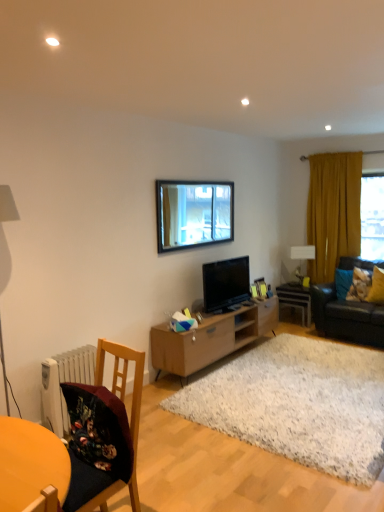
Question: Does white shaggy rug at center lie in front of yellow fabric pillow at right, acting as the second pillow starting from the left?

Choices:
 (A) yes
 (B) no

Answer: (A)

Question: Is white shaggy rug at center taller than yellow fabric pillow at right, acting as the second pillow starting from the left?

Choices:
 (A) yes
 (B) no

Answer: (B)

Question: Considering the relative sizes of white shaggy rug at center and yellow fabric pillow at right, acting as the second pillow starting from the left, in the image provided, is white shaggy rug at center shorter than yellow fabric pillow at right, acting as the second pillow starting from the left,?

Choices:
 (A) yes
 (B) no

Answer: (A)

Question: Can you confirm if white shaggy rug at center is smaller than yellow fabric pillow at right, acting as the second pillow starting from the left?

Choices:
 (A) yes
 (B) no

Answer: (B)

Question: Is white shaggy rug at center looking in the opposite direction of yellow fabric pillow at right, positioned as the 1th pillow in right-to-left order?

Choices:
 (A) yes
 (B) no

Answer: (B)

Question: Choose the correct answer: Is light brown wood tv stand at center inside white glossy side table at center or outside it?

Choices:
 (A) inside
 (B) outside

Answer: (B)

Question: From a real-world perspective, is light brown wood tv stand at center physically located above or below white glossy side table at center?

Choices:
 (A) below
 (B) above

Answer: (B)

Question: In terms of size, does light brown wood tv stand at center appear bigger or smaller than white glossy side table at center?

Choices:
 (A) small
 (B) big

Answer: (B)

Question: Considering their positions, is light brown wood tv stand at center located in front of or behind white glossy side table at center?

Choices:
 (A) front
 (B) behind

Answer: (A)

Question: From a real-world perspective, is white glossy side table at center physically located above or below wooden picture frame at center, placed as the 2th picture frame when sorted from right to left?

Choices:
 (A) below
 (B) above

Answer: (A)

Question: From the image's perspective, is white glossy side table at center located above or below wooden picture frame at center, which is the 1th picture frame in left-to-right order?

Choices:
 (A) above
 (B) below

Answer: (B)

Question: From their relative heights in the image, would you say white glossy side table at center is taller or shorter than wooden picture frame at center, which is the 1th picture frame in left-to-right order?

Choices:
 (A) tall
 (B) short

Answer: (A)

Question: Does point (304, 303) appear closer or farther from the camera than point (256, 285)?

Choices:
 (A) closer
 (B) farther

Answer: (B)

Question: Considering the positions of mustard yellow fabric curtain at right and wooden chair at lower left in the image, is mustard yellow fabric curtain at right wider or thinner than wooden chair at lower left?

Choices:
 (A) wide
 (B) thin

Answer: (B)

Question: Considering the positions of point (334, 184) and point (97, 385), is point (334, 184) closer or farther from the camera than point (97, 385)?

Choices:
 (A) farther
 (B) closer

Answer: (A)